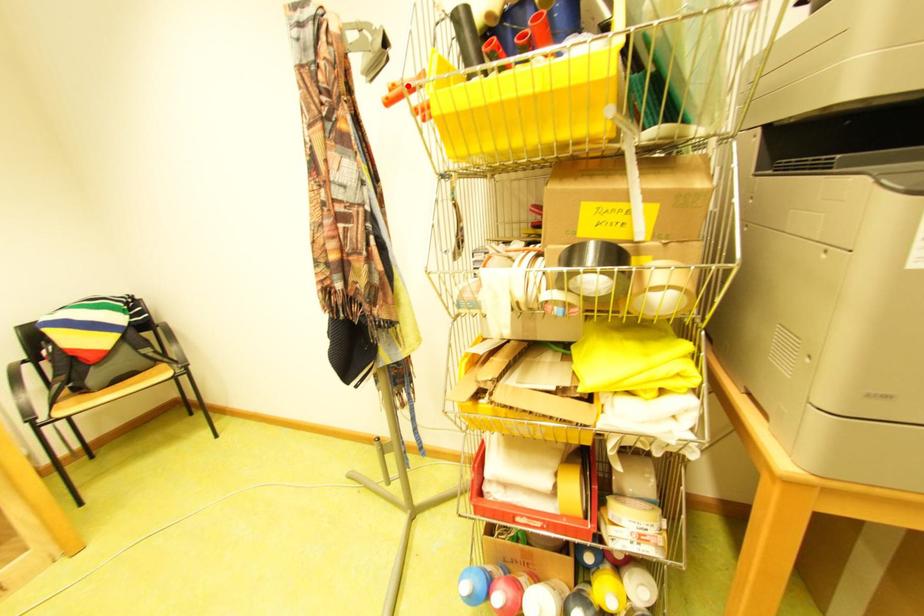
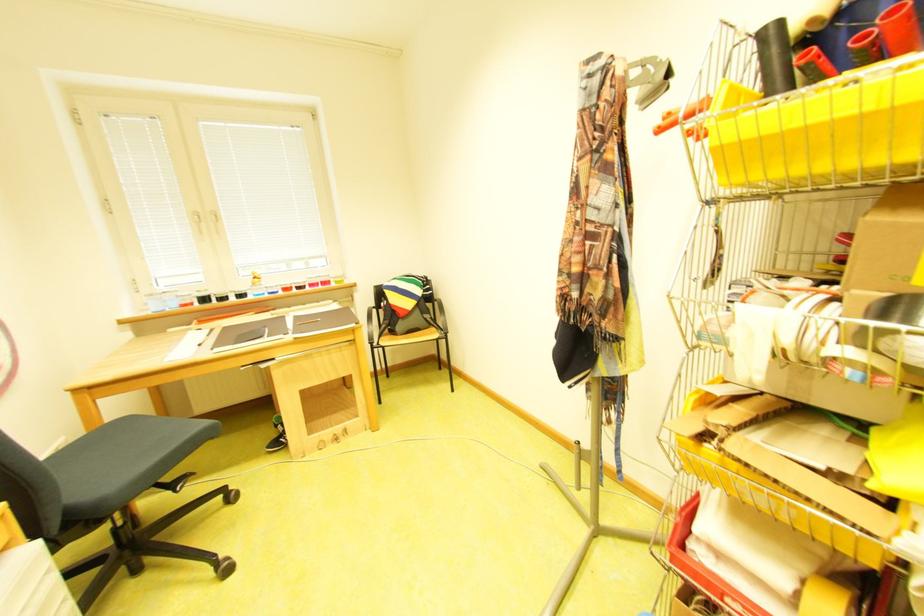
In the second image, find the point that corresponds to the highlighted location in the first image.

(687, 111)